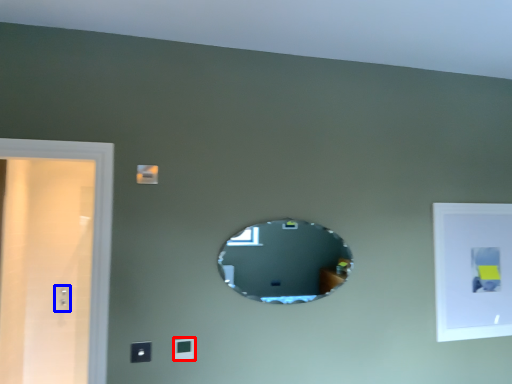
Question: Which point is further to the camera, light switch (highlighted by a red box) or electric outlet (highlighted by a blue box)?

Choices:
 (A) light switch
 (B) electric outlet

Answer: (B)